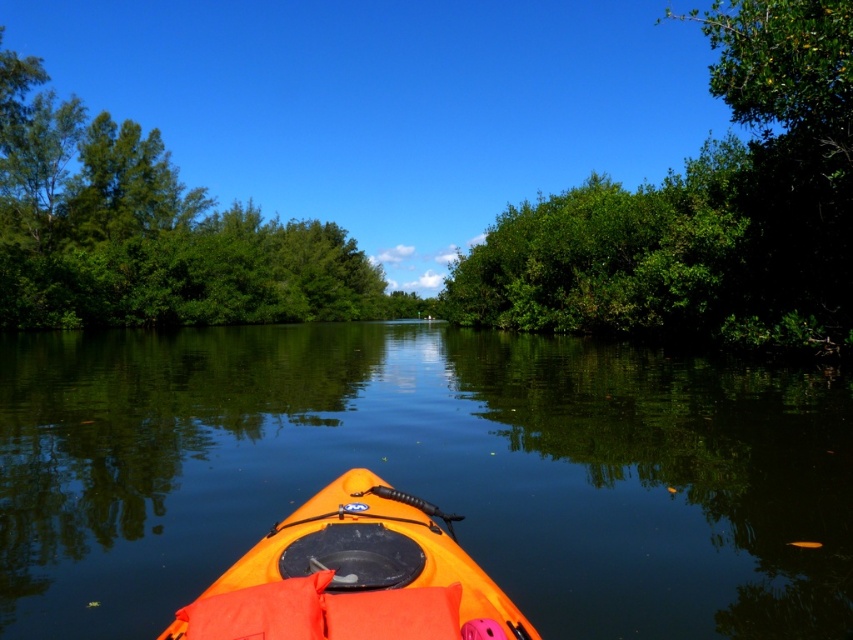
You are in a kayak and want to navigate between two points marked on your map. The first point is at coordinate point(378, 352) and the second is at point(456, 269). Which point is closer to your current position in the kayak?

Point(378, 352) is closer to the viewer than point(456, 269), so the first point is closer to your current position in the kayak.